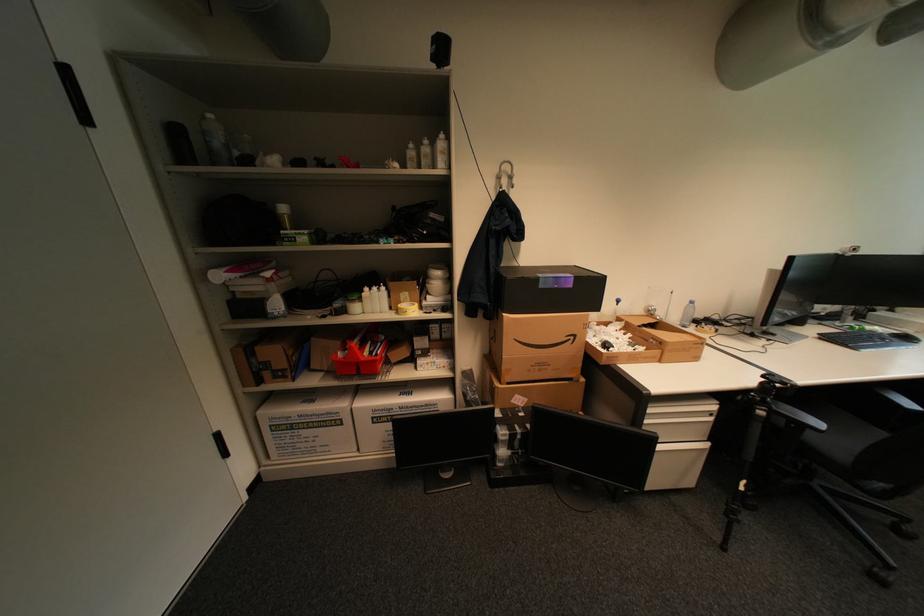
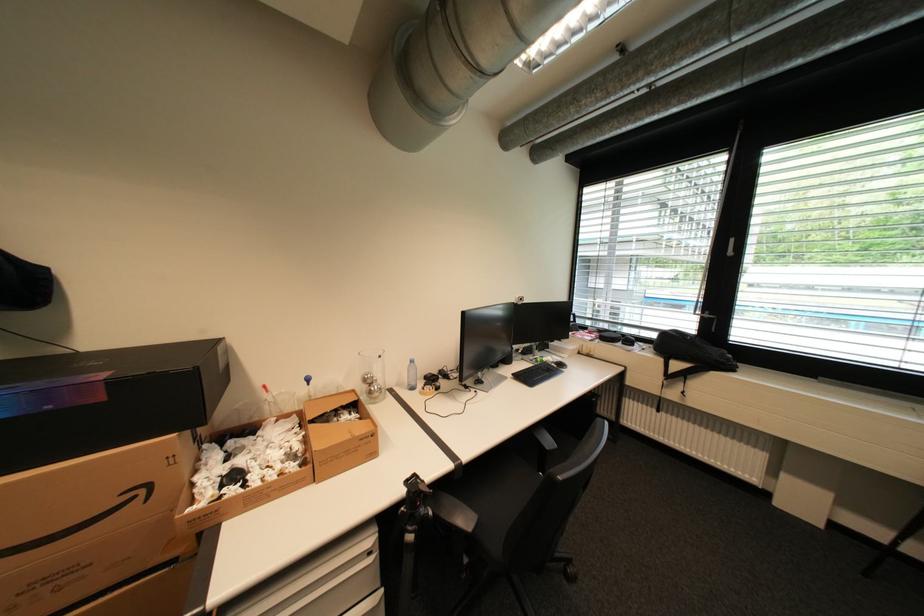
Find the pixel in the second image that matches pixel 580 338 in the first image.

(151, 491)